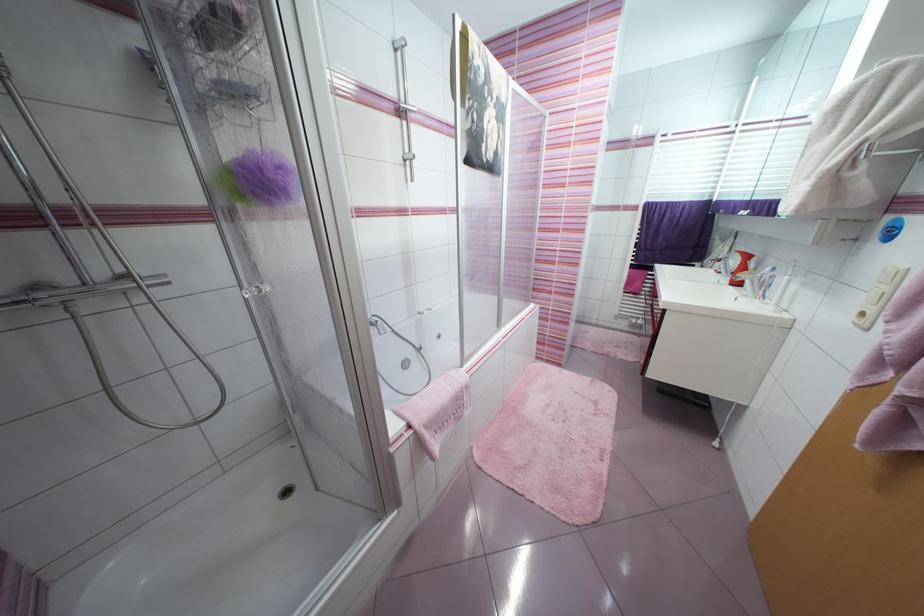
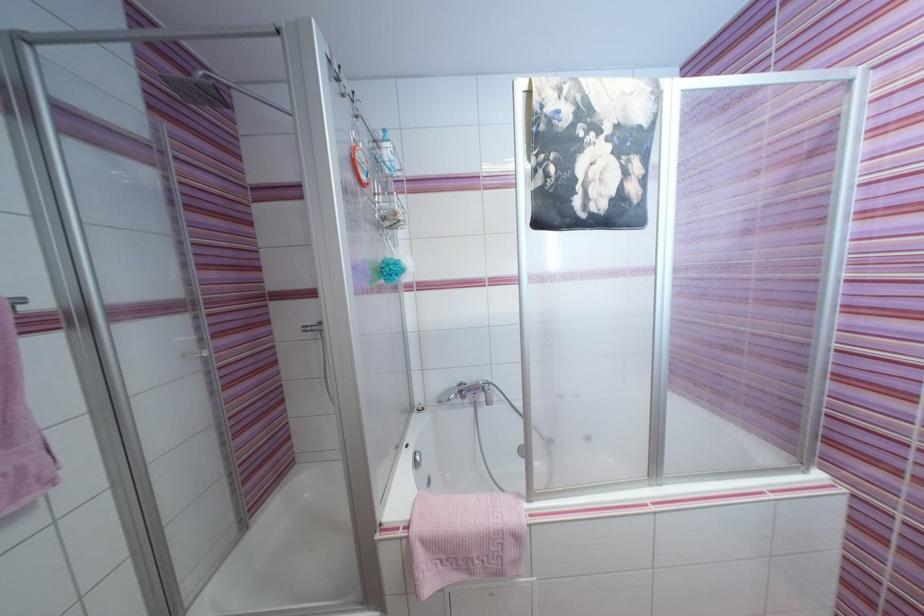
Locate, in the second image, the point that corresponds to point (472, 389) in the first image.

(521, 539)